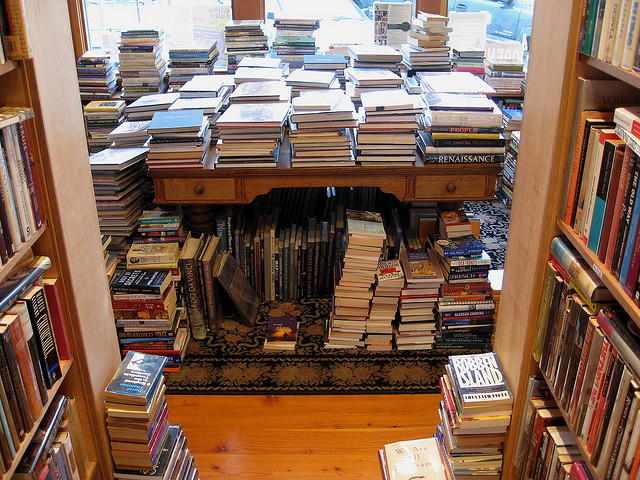
The image size is (640, 480). Identify the location of books. (603, 250).